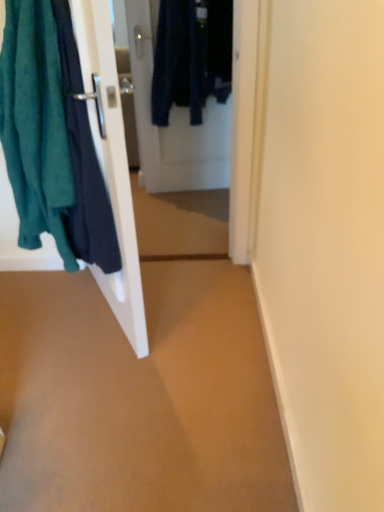
Question: From the image's perspective, is white glossy door at center, positioned as the second door in front-to-back order, located above white glossy door at left, positioned as the second door in back-to-front order?

Choices:
 (A) no
 (B) yes

Answer: (B)

Question: Is white glossy door at left, positioned as the second door in back-to-front order, at the back of white glossy door at center, acting as the 1th door starting from the back?

Choices:
 (A) yes
 (B) no

Answer: (B)

Question: Does white glossy door at center, acting as the 1th door starting from the back, appear on the right side of white glossy door at left, the 1th door in the front-to-back sequence?

Choices:
 (A) yes
 (B) no

Answer: (A)

Question: Can you confirm if white glossy door at center, positioned as the second door in front-to-back order, is thinner than white glossy door at left, the 1th door in the front-to-back sequence?

Choices:
 (A) yes
 (B) no

Answer: (A)

Question: From the image's perspective, does white glossy door at center, acting as the 1th door starting from the back, appear lower than white glossy door at left, positioned as the second door in back-to-front order?

Choices:
 (A) no
 (B) yes

Answer: (A)

Question: Considering the positions of teal fabric towel at left and white glossy door at left, the 1th door in the front-to-back sequence, in the image, is teal fabric towel at left bigger or smaller than white glossy door at left, the 1th door in the front-to-back sequence,?

Choices:
 (A) small
 (B) big

Answer: (B)

Question: From their relative heights in the image, would you say teal fabric towel at left is taller or shorter than white glossy door at left, the 1th door in the front-to-back sequence?

Choices:
 (A) tall
 (B) short

Answer: (B)

Question: Considering the positions of teal fabric towel at left and white glossy door at left, positioned as the second door in back-to-front order, in the image, is teal fabric towel at left wider or thinner than white glossy door at left, positioned as the second door in back-to-front order,?

Choices:
 (A) thin
 (B) wide

Answer: (B)

Question: Is point (18, 25) positioned closer to the camera than point (74, 0)?

Choices:
 (A) closer
 (B) farther

Answer: (B)

Question: Is point (92, 268) positioned closer to the camera than point (6, 122)?

Choices:
 (A) closer
 (B) farther

Answer: (B)

Question: Is white glossy door at left, the 1th door in the front-to-back sequence, wider or thinner than teal fabric towel at left?

Choices:
 (A) wide
 (B) thin

Answer: (B)

Question: From a real-world perspective, is white glossy door at left, the 1th door in the front-to-back sequence, physically located above or below teal fabric towel at left?

Choices:
 (A) below
 (B) above

Answer: (A)

Question: From the image's perspective, is white glossy door at left, positioned as the second door in back-to-front order, positioned above or below teal fabric towel at left?

Choices:
 (A) above
 (B) below

Answer: (B)

Question: Is point (23, 188) closer or farther from the camera than point (1, 463)?

Choices:
 (A) farther
 (B) closer

Answer: (A)

Question: Considering the relative positions of teal fabric towel at left and brown matte carpet at center in the image provided, is teal fabric towel at left to the left or to the right of brown matte carpet at center?

Choices:
 (A) right
 (B) left

Answer: (B)